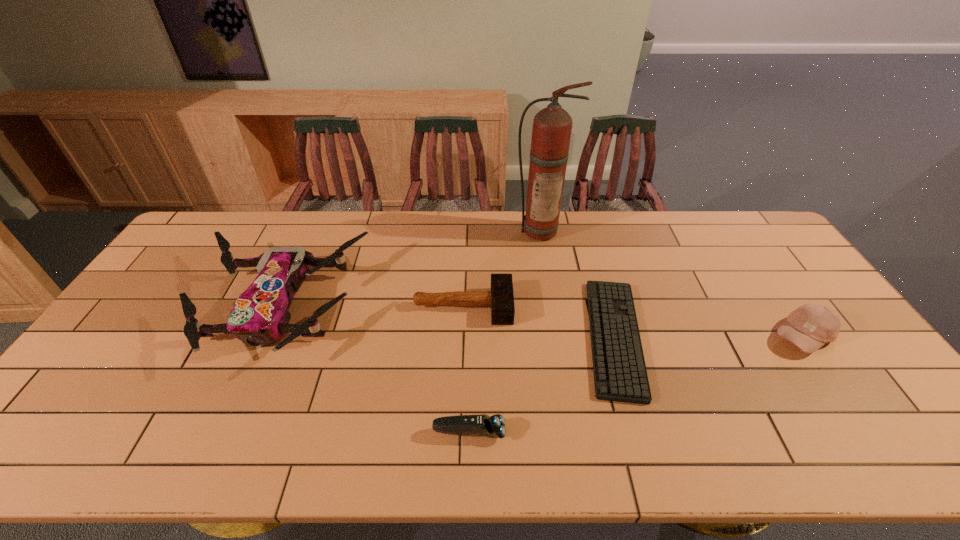
This screenshot has width=960, height=540. I want to click on free point at the left edge, so click(171, 315).

Identify the location of free space at the far left corner of the desktop. The height and width of the screenshot is (540, 960). (206, 221).

The width and height of the screenshot is (960, 540). Find the location of `free location at the near left corner`. free location at the near left corner is located at coordinates (23, 449).

I want to click on free space that is in between the baseball cap and the farthest object, so click(x=671, y=283).

Identify the location of vacant space in between the mallet and the fire extinguisher. This screenshot has width=960, height=540. (502, 268).

Where is `unoccupied area between the computer keyboard and the second tallest object`? This screenshot has height=540, width=960. unoccupied area between the computer keyboard and the second tallest object is located at coordinates (446, 322).

What are the coordinates of `vacant area between the mallet and the electric shaver` in the screenshot? It's located at (467, 369).

Image resolution: width=960 pixels, height=540 pixels. Identify the location of vacant space that's between the electric shaver and the computer keyboard. (541, 384).

Identify the location of free space between the fire extinguisher and the leftmost object. (409, 269).

The height and width of the screenshot is (540, 960). I want to click on empty space between the farthest object and the computer keyboard, so click(x=577, y=284).